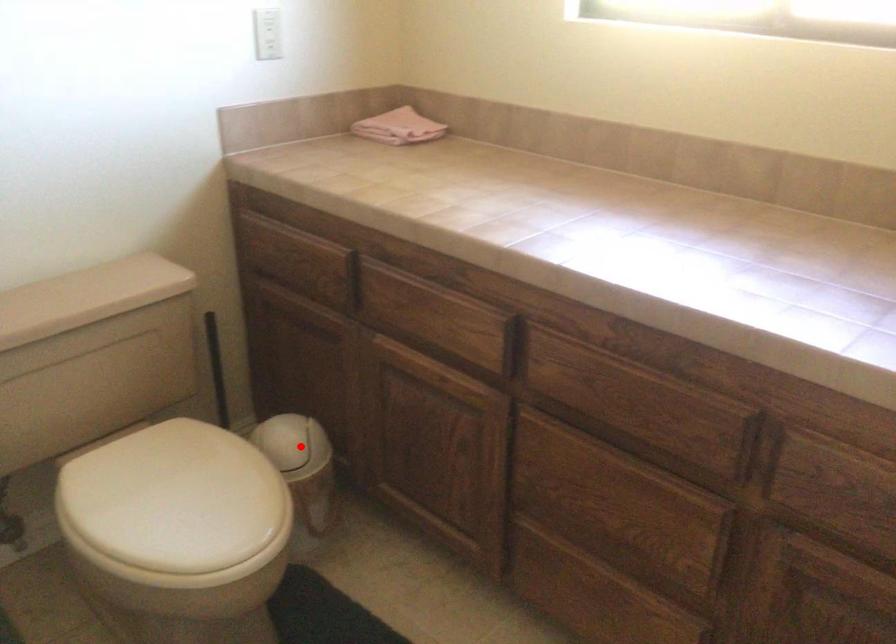
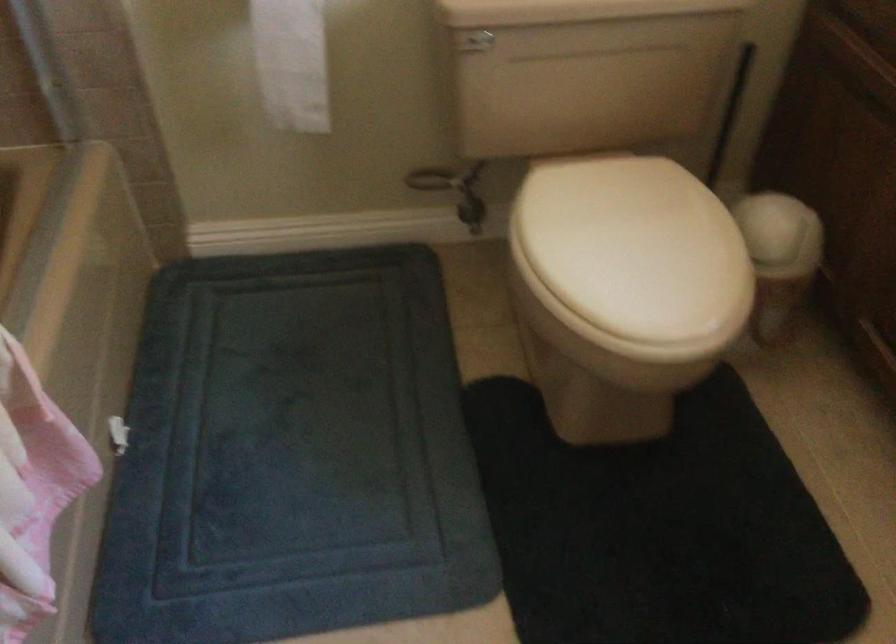
Question: I am providing you with two images of the same scene from different viewpoints. Given a red point in image1, look at the same physical point in image2. Is it:

Choices:
 (A) Closer to the viewpoint
 (B) Farther from the viewpoint

Answer: (A)